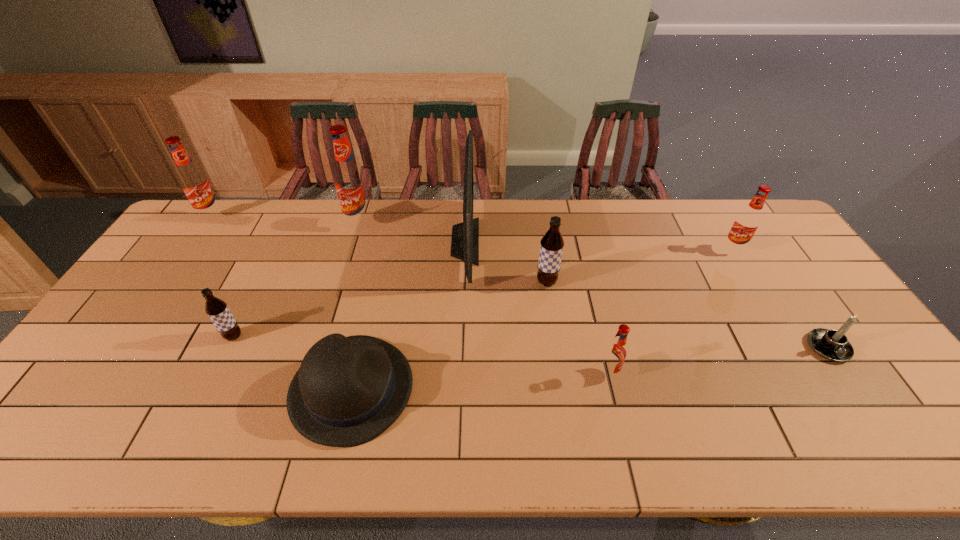
The image size is (960, 540). In order to click on the third object from right to left in this screenshot , I will do `click(615, 353)`.

Where is `the fifth root beer from left to right`? The width and height of the screenshot is (960, 540). the fifth root beer from left to right is located at coordinates (615, 353).

Locate an element on the screen. The image size is (960, 540). the nearer brown root beer is located at coordinates (217, 310).

The height and width of the screenshot is (540, 960). In order to click on the left brown root beer in this screenshot , I will do `click(217, 310)`.

Identify the location of bowler hat. (348, 390).

Find the location of a particular element. This screenshot has height=540, width=960. the rightmost object is located at coordinates (833, 345).

You are a GUI agent. You are given a task and a screenshot of the screen. Output one action in this format:
    pyautogui.click(x=<x>, y=<y>)
    Task: Click on the vacant space situated 0.080m on the right of the tallest root beer
    
    Given the screenshot: What is the action you would take?
    pyautogui.click(x=397, y=224)

You are a GUI agent. You are given a task and a screenshot of the screen. Output one action in this format:
    pyautogui.click(x=<x>, y=<y>)
    Task: Click on the free space located 0.320m on the front of the leftmost object
    The height and width of the screenshot is (540, 960).
    Given the screenshot: What is the action you would take?
    pyautogui.click(x=160, y=289)

I want to click on free point located 0.180m on the screen side of the black monitor, so click(x=533, y=242).

This screenshot has width=960, height=540. Identify the location of vacant area situated 0.070m on the right of the farther brown root beer. (581, 282).